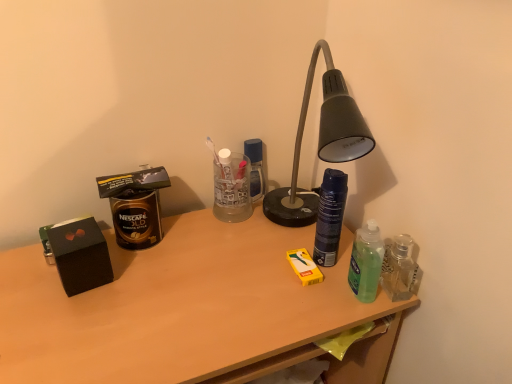
Question: Based on their sizes in the image, would you say wooden desk at center is bigger or smaller than green translucent bottle at right, which is the first bottle in right-to-left order?

Choices:
 (A) small
 (B) big

Answer: (B)

Question: From their relative heights in the image, would you say wooden desk at center is taller or shorter than green translucent bottle at right, which is the first bottle in right-to-left order?

Choices:
 (A) tall
 (B) short

Answer: (A)

Question: Estimate the real-world distances between objects in this image. Which object is closer to the wooden desk at center?

Choices:
 (A) gold matte canister at left
 (B) dark blue matte spray can at center, positioned as the 1th bottle in left-to-right order
 (C) green translucent bottle at right, which is the 2th bottle in left-to-right order

Answer: (A)

Question: Estimate the real-world distances between objects in this image. Which object is closer to the wooden desk at center?

Choices:
 (A) green translucent bottle at right, which is the first bottle in right-to-left order
 (B) gold matte canister at left
 (C) dark blue matte spray can at center, positioned as the 1th bottle in left-to-right order

Answer: (B)